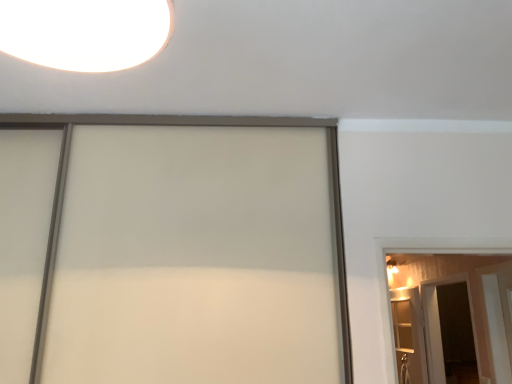
Question: Should I look upward or downward to see wooden elevator at right?

Choices:
 (A) up
 (B) down

Answer: (B)

Question: Is transparent glass screen door at lower right closer to camera compared to wooden elevator at right?

Choices:
 (A) no
 (B) yes

Answer: (A)

Question: From a real-world perspective, is transparent glass screen door at lower right below wooden elevator at right?

Choices:
 (A) yes
 (B) no

Answer: (B)

Question: Can we say transparent glass screen door at lower right lies outside wooden elevator at right?

Choices:
 (A) no
 (B) yes

Answer: (B)

Question: From a real-world perspective, does transparent glass screen door at lower right stand above wooden elevator at right?

Choices:
 (A) no
 (B) yes

Answer: (B)

Question: From the image's perspective, is transparent glass screen door at lower right on top of wooden elevator at right?

Choices:
 (A) yes
 (B) no

Answer: (A)

Question: Could you tell me if transparent glass screen door at lower right is facing wooden elevator at right?

Choices:
 (A) yes
 (B) no

Answer: (B)

Question: Does white glossy barn door at right have a larger size compared to wooden elevator at right?

Choices:
 (A) yes
 (B) no

Answer: (A)

Question: Is white glossy barn door at right wider than wooden elevator at right?

Choices:
 (A) yes
 (B) no

Answer: (A)

Question: Could you tell me if white glossy barn door at right is facing wooden elevator at right?

Choices:
 (A) no
 (B) yes

Answer: (A)

Question: From the image's perspective, is white glossy barn door at right beneath wooden elevator at right?

Choices:
 (A) no
 (B) yes

Answer: (A)

Question: Considering the relative sizes of white glossy barn door at right and wooden elevator at right in the image provided, is white glossy barn door at right smaller than wooden elevator at right?

Choices:
 (A) no
 (B) yes

Answer: (A)

Question: Is white glossy barn door at right at the left side of wooden elevator at right?

Choices:
 (A) yes
 (B) no

Answer: (B)

Question: Is wooden elevator at right next to transparent glass screen door at lower right?

Choices:
 (A) yes
 (B) no

Answer: (B)